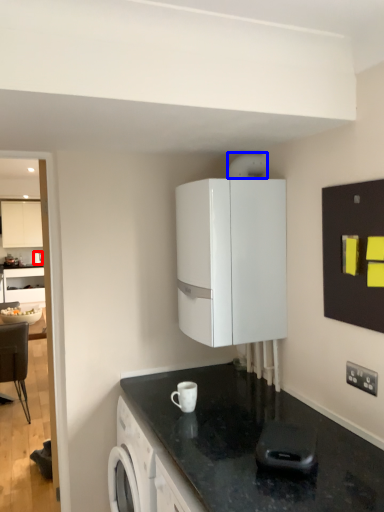
Question: Which point is closer to the camera, kitchen appliance (highlighted by a red box) or appliance (highlighted by a blue box)?

Choices:
 (A) kitchen appliance
 (B) appliance

Answer: (B)